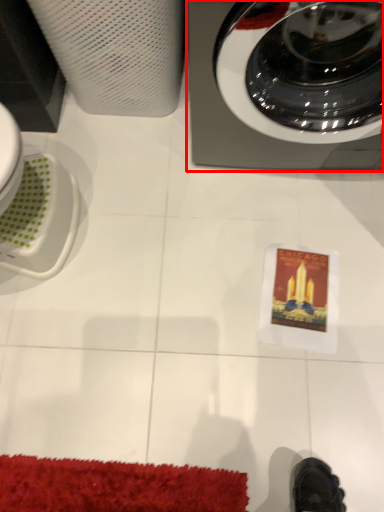
Question: From the image's perspective, considering the relative positions of home appliance (annotated by the red box) and paper towel in the image provided, where is home appliance (annotated by the red box) located with respect to the staircase?

Choices:
 (A) above
 (B) below

Answer: (B)